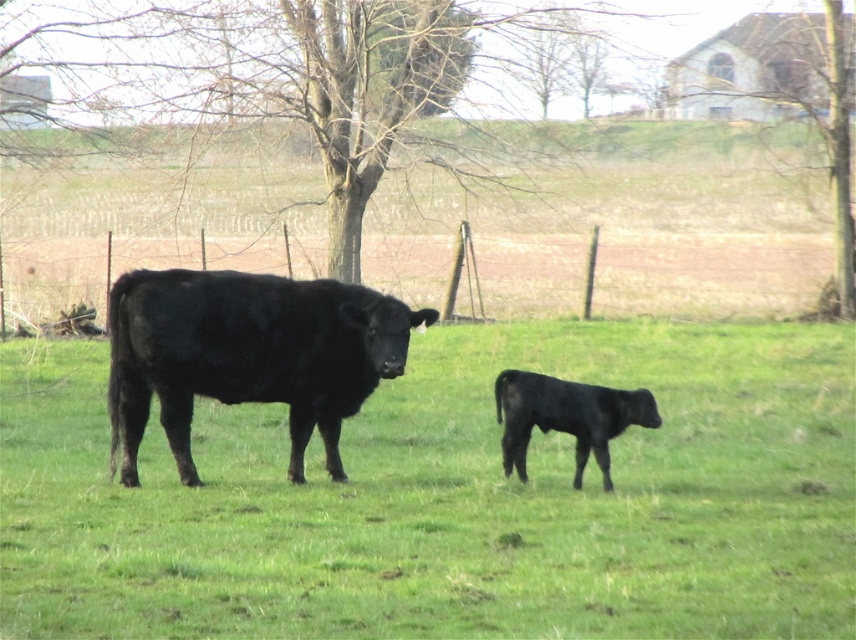
Is green grass at center wider than shiny black bull at center?

Yes, green grass at center is wider than shiny black bull at center.

Find the location of `green grass at center`. green grass at center is located at coordinates (449, 499).

Who is positioned more to the right, bare wood tree at center or bare wood tree at upper right?

From the viewer's perspective, bare wood tree at upper right appears more on the right side.

Is point (324, 44) positioned before point (841, 36)?

Yes, point (324, 44) is closer to viewer.

Does point (200, 54) come closer to viewer compared to point (843, 310)?

No, (200, 54) is further to viewer.

The width and height of the screenshot is (856, 640). I want to click on bare wood tree at center, so click(280, 70).

Between green grass at center and bare wood tree at center, which one has more height?

bare wood tree at center

Can you confirm if green grass at center is positioned below bare wood tree at center?

Yes, green grass at center is below bare wood tree at center.

The image size is (856, 640). What are the coordinates of `green grass at center` in the screenshot? It's located at (449, 499).

This screenshot has width=856, height=640. What are the coordinates of `green grass at center` in the screenshot? It's located at (449, 499).